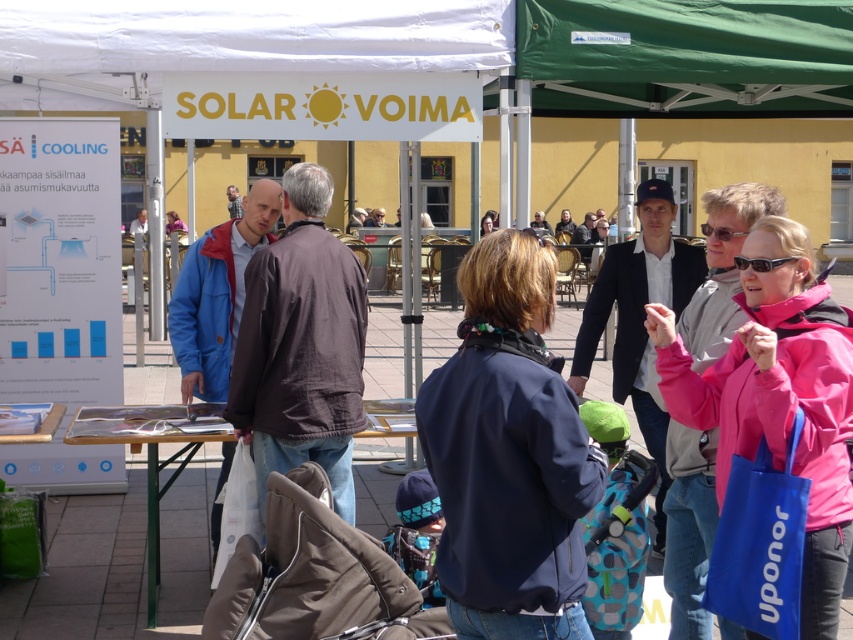
Is green fabric bag at lower left positioned in front of light brown leather jacket at center?

Yes, it is in front of light brown leather jacket at center.

Is point (33, 532) behind point (231, 198)?

No.

Does point (6, 497) lie in front of point (231, 192)?

Yes, it is.

This screenshot has width=853, height=640. Find the location of `green fabric bag at lower left`. green fabric bag at lower left is located at coordinates (22, 532).

Does wooden table at center appear on the left side of green fabric bag at lower left?

Incorrect, wooden table at center is not on the left side of green fabric bag at lower left.

Who is lower down, wooden table at center or green fabric bag at lower left?

Positioned lower is green fabric bag at lower left.

Where is `wooden table at center`? The image size is (853, 640). wooden table at center is located at coordinates (151, 456).

Between point (566, 404) and point (315, 186), which one is positioned in front?

Point (566, 404)

Does point (508, 436) come behind point (273, 296)?

No.

Does point (491, 499) come behind point (360, 346)?

That is False.

Identify the location of navy blue jacket at center. (508, 454).